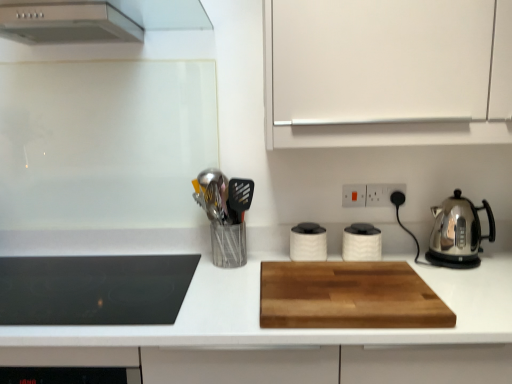
I want to click on free location above black glass cooktop at left, the 1th kitchen appliance when ordered from left to right (from a real-world perspective), so click(90, 281).